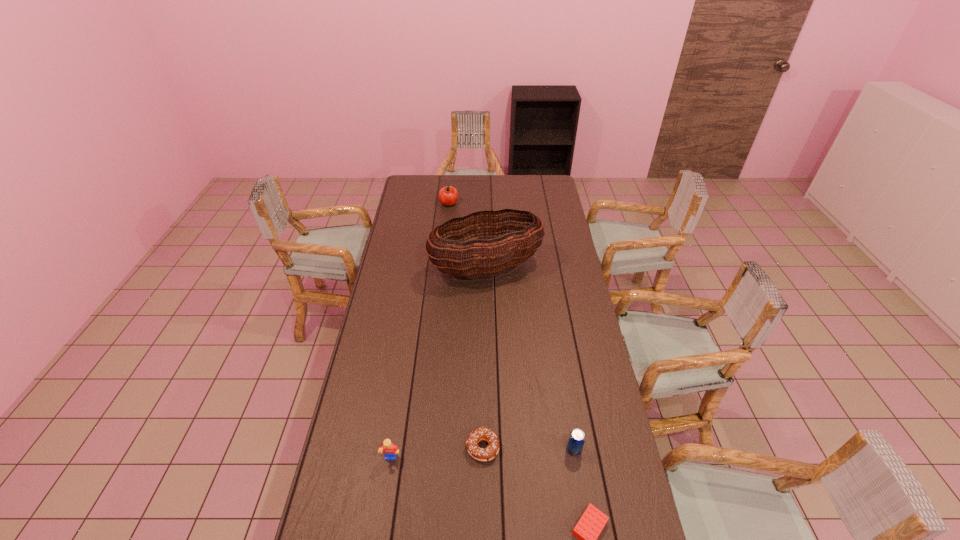
Where is `the fifth nearest object`? the fifth nearest object is located at coordinates (475, 257).

The height and width of the screenshot is (540, 960). Identify the location of basket. (475, 257).

You are a GUI agent. You are given a task and a screenshot of the screen. Output one action in this format:
    pyautogui.click(x=<x>, y=<y>)
    Task: Click on the farthest object
    The image size is (960, 540).
    Given the screenshot: What is the action you would take?
    pyautogui.click(x=448, y=196)

This screenshot has width=960, height=540. In order to click on the farther Lego in this screenshot , I will do `click(389, 450)`.

Find the location of `the leftmost object`. the leftmost object is located at coordinates (389, 450).

Where is `beer can`? beer can is located at coordinates (576, 440).

The width and height of the screenshot is (960, 540). Identify the location of doughnut. (481, 433).

This screenshot has height=540, width=960. What are the coordinates of `blank area located 0.100m on the left of the tallest object` in the screenshot? It's located at (408, 268).

Identify the location of vacant space located on the front of the apple. This screenshot has height=540, width=960. (447, 214).

Where is `vacant space located on the face of the taller Lego`? vacant space located on the face of the taller Lego is located at coordinates (382, 517).